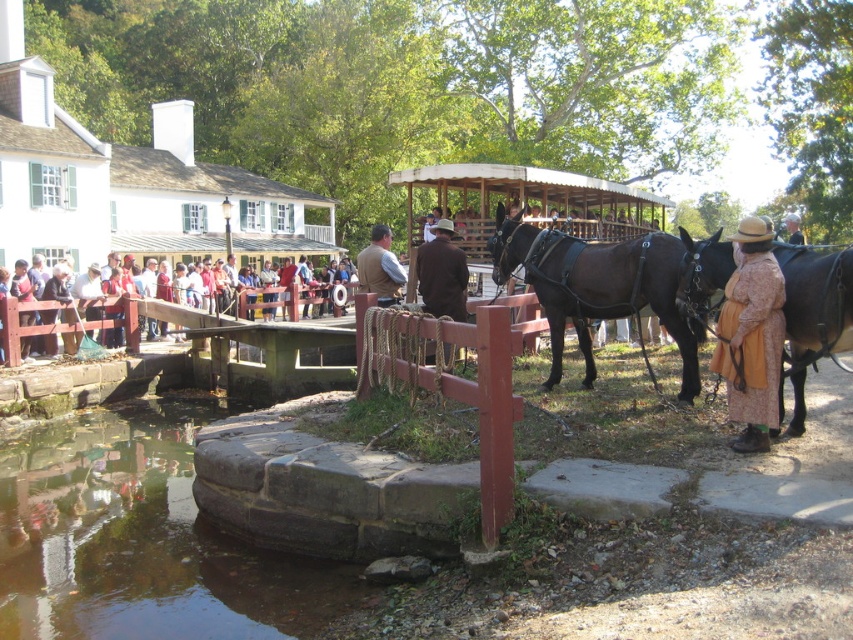
You are a painter standing at the edge of the stream. You want to paint both the dark brown leather horse at center and the red shirt at center. Which object should you focus on first if you want to paint the taller one first?

The dark brown leather horse at center is much taller than the red shirt at center, so you should focus on painting the dark brown leather horse at center first.

You are a painter standing at the edge of the stream under the stone bridge. You want to paint the dark brown leather horse at center and the red shirt at center. Which object should you focus on first to capture its details more clearly?

The dark brown leather horse at center is closer to the viewer than the red shirt at center, so you should focus on painting the dark brown leather horse at center first to capture its details more clearly before moving to the farther red shirt at center.

In the scene shown: You are a tourist standing at the stone bridge in the scene. You want to take a photo of the brown glossy horse at center and the red shirt at center together in one frame. Given that your camera has a maximum zoom range of 10 meters, will you be able to capture both subjects in the same photo?

The brown glossy horse at center and the red shirt at center are 11.24 meters apart. Since the maximum zoom range is 10 meters, the distance between them exceeds the camera capability, so you cannot capture both in the same frame.